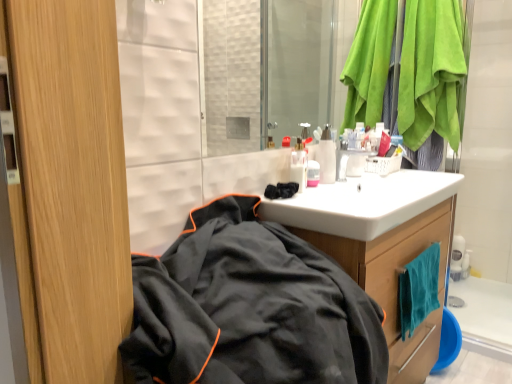
Question: Considering the positions of translucent plastic bottles at center, which is the second toiletry in right-to-left order, and green suede towel at upper right in the image, is translucent plastic bottles at center, which is the second toiletry in right-to-left order, wider or thinner than green suede towel at upper right?

Choices:
 (A) thin
 (B) wide

Answer: (A)

Question: Looking at the image, does translucent plastic bottles at center, which ranks as the first toiletry in left-to-right order, seem bigger or smaller compared to green suede towel at upper right?

Choices:
 (A) big
 (B) small

Answer: (B)

Question: Estimate the real-world distances between objects in this image. Which object is farther from the white glossy sink at center?

Choices:
 (A) translucent plastic bottles at center, which is the second toiletry in right-to-left order
 (B) black fabric jacket at lower left
 (C) green suede towel at upper right
 (D) teal microfiber towel at lower right
 (E) pink glossy container at center, the second toiletry viewed from the left

Answer: (C)

Question: Which object is positioned closest to the pink glossy container at center, marked as the first toiletry in a right-to-left arrangement?

Choices:
 (A) teal microfiber towel at lower right
 (B) translucent plastic bottles at center, which is the second toiletry in right-to-left order
 (C) wooden cabinet at center
 (D) green suede towel at upper right
 (E) black fabric jacket at lower left

Answer: (B)